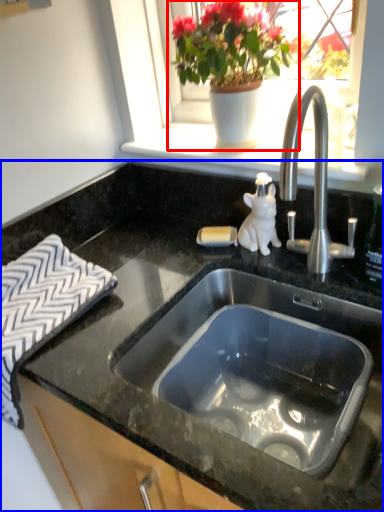
Question: Which of the following is the closest to the observer, houseplant (highlighted by a red box) or countertop (highlighted by a blue box)?

Choices:
 (A) houseplant
 (B) countertop

Answer: (B)